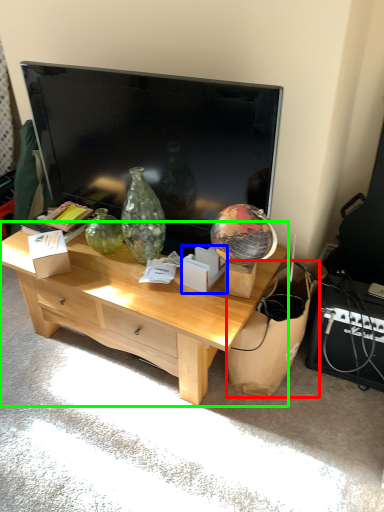
Question: Based on their relative distances, which object is farther from cardboard (highlighted by a red box)? Choose from cardboard box (highlighted by a blue box) and desk (highlighted by a green box).

Choices:
 (A) cardboard box
 (B) desk

Answer: (B)